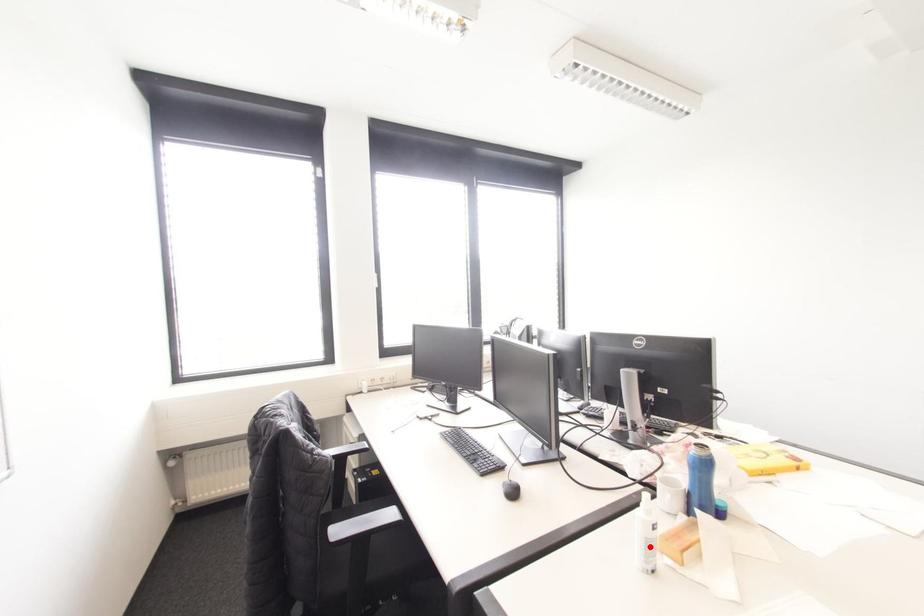
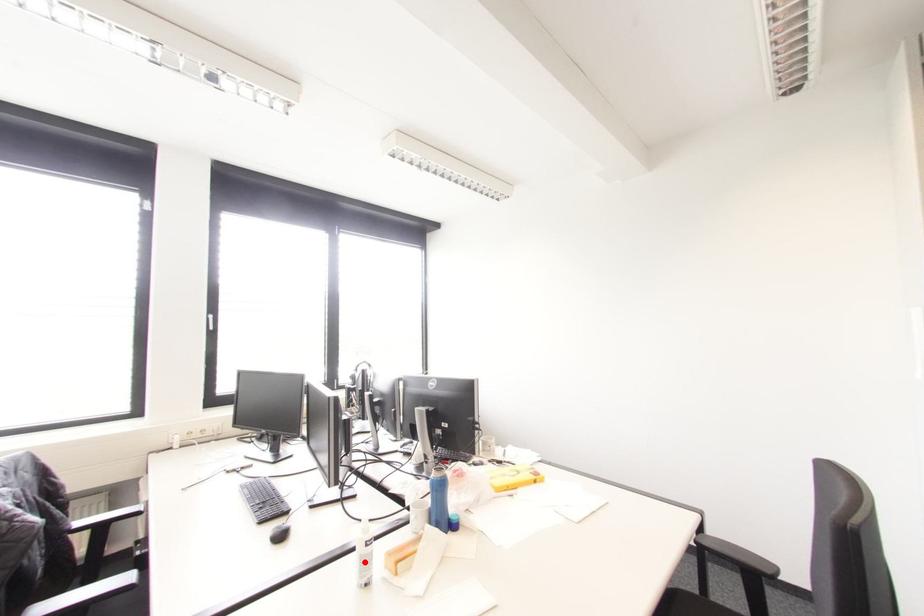
I am providing you with two images of the same scene from different viewpoints. A red point is marked on the first image and another point is marked on the second image. Are the points marked in image1 and image2 representing the same 3D position?

Yes